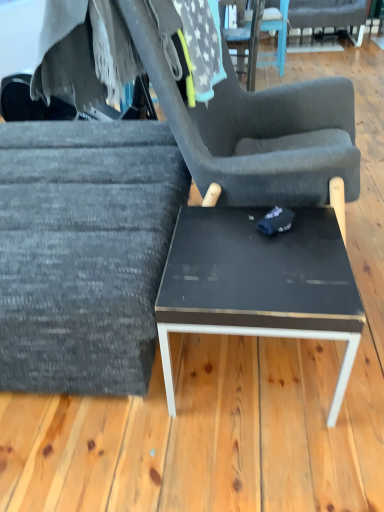
How much space does dark gray fabric chair at upper right, the third chair positioned from the bottom, occupy horizontally?

dark gray fabric chair at upper right, the third chair positioned from the bottom, is 30.17 inches wide.

What is the approximate height of black glossy table at center?

The height of black glossy table at center is 42.81 centimeters.

The height and width of the screenshot is (512, 384). I want to click on textured gray fabric chair at left, which ranks as the first chair in left-to-right order, so click(x=84, y=252).

Describe the element at coordinates (257, 131) in the screenshot. The height and width of the screenshot is (512, 384). I see `textured gray fabric chair at center, marked as the 2th chair in a left-to-right arrangement` at that location.

Locate an element on the screen. Image resolution: width=384 pixels, height=512 pixels. fuzzy gray blanket at upper left is located at coordinates (84, 53).

Which is more to the left, textured gray fabric chair at center, positioned as the 2th chair in back-to-front order, or dark gray fabric chair at upper right, placed as the 3th chair when sorted from left to right?

Positioned to the left is textured gray fabric chair at center, positioned as the 2th chair in back-to-front order.

Is textured gray fabric chair at center, the second chair from the bottom, looking in the opposite direction of dark gray fabric chair at upper right, marked as the first chair in a right-to-left arrangement?

No, textured gray fabric chair at center, the second chair from the bottom,'s orientation is not away from dark gray fabric chair at upper right, marked as the first chair in a right-to-left arrangement.

Identify the location of chair that is the 2nd one above the dark gray fabric chair at upper right, marked as the first chair in a right-to-left arrangement (from a real-world perspective). Image resolution: width=384 pixels, height=512 pixels. (257, 131).

Is fuzzy gray blanket at upper left facing away from black glossy table at center?

fuzzy gray blanket at upper left does not have its back to black glossy table at center.

Is fuzzy gray blanket at upper left wider or thinner than black glossy table at center?

Clearly, fuzzy gray blanket at upper left has more width compared to black glossy table at center.

Are fuzzy gray blanket at upper left and black glossy table at center beside each other?

There is a gap between fuzzy gray blanket at upper left and black glossy table at center.

Which is more to the right, fuzzy gray blanket at upper left or black glossy table at center?

Positioned to the right is black glossy table at center.

Which object is positioned more to the left, textured gray fabric chair at left, which ranks as the first chair in left-to-right order, or black glossy table at center?

textured gray fabric chair at left, which ranks as the first chair in left-to-right order, is more to the left.

In the scene shown: Is textured gray fabric chair at left, which ranks as the first chair in left-to-right order, not near black glossy table at center?

textured gray fabric chair at left, which ranks as the first chair in left-to-right order, is actually quite close to black glossy table at center.

From the image's perspective, who appears lower, textured gray fabric chair at left, the first chair in the front-to-back sequence, or black glossy table at center?

black glossy table at center is shown below in the image.

Is dark gray fabric chair at upper right, the third chair positioned from the bottom, positioned far away from black glossy table at center?

dark gray fabric chair at upper right, the third chair positioned from the bottom, is positioned a significant distance from black glossy table at center.

Does dark gray fabric chair at upper right, placed as the first chair when sorted from back to front, appear on the right side of black glossy table at center?

Yes, dark gray fabric chair at upper right, placed as the first chair when sorted from back to front, is to the right of black glossy table at center.

Which object is thinner, dark gray fabric chair at upper right, placed as the first chair when sorted from back to front, or black glossy table at center?

black glossy table at center.

Consider the image. Which is nearer, (346, 17) or (347, 366)?

Positioned in front is point (347, 366).

From the picture: Does black glossy table at center have a lesser height compared to textured gray fabric chair at center, acting as the 2th chair starting from the top?

Yes, black glossy table at center is shorter than textured gray fabric chair at center, acting as the 2th chair starting from the top.

Find the location of a particular element. Image resolution: width=384 pixels, height=512 pixels. coffee table behind the textured gray fabric chair at center, acting as the 2th chair starting from the top is located at coordinates (259, 283).

Choose the correct answer: Is black glossy table at center inside textured gray fabric chair at center, positioned as the 2th chair in back-to-front order, or outside it?

black glossy table at center is not enclosed by textured gray fabric chair at center, positioned as the 2th chair in back-to-front order.

Does black glossy table at center have a larger size compared to textured gray fabric chair at center, the second chair when ordered from right to left?

Actually, black glossy table at center might be smaller than textured gray fabric chair at center, the second chair when ordered from right to left.

Is dark gray fabric chair at upper right, placed as the 3th chair when sorted from left to right, positioned with its back to textured gray fabric chair at center, positioned as the 2th chair in back-to-front order?

dark gray fabric chair at upper right, placed as the 3th chair when sorted from left to right, does not have its back to textured gray fabric chair at center, positioned as the 2th chair in back-to-front order.

Considering the positions of objects dark gray fabric chair at upper right, marked as the first chair in a right-to-left arrangement, and textured gray fabric chair at center, positioned as the 2th chair in front-to-back order, in the image provided, who is in front, dark gray fabric chair at upper right, marked as the first chair in a right-to-left arrangement, or textured gray fabric chair at center, positioned as the 2th chair in front-to-back order,?

textured gray fabric chair at center, positioned as the 2th chair in front-to-back order.

Considering the relative positions of dark gray fabric chair at upper right, which is the third chair in front-to-back order, and textured gray fabric chair at center, acting as the 2th chair starting from the top, in the image provided, is dark gray fabric chair at upper right, which is the third chair in front-to-back order, to the right of textured gray fabric chair at center, acting as the 2th chair starting from the top, from the viewer's perspective?

Yes, dark gray fabric chair at upper right, which is the third chair in front-to-back order, is to the right of textured gray fabric chair at center, acting as the 2th chair starting from the top.

Does dark gray fabric chair at upper right, which is the third chair in front-to-back order, have a lesser height compared to textured gray fabric chair at center, marked as the 2th chair in a left-to-right arrangement?

Indeed, dark gray fabric chair at upper right, which is the third chair in front-to-back order, has a lesser height compared to textured gray fabric chair at center, marked as the 2th chair in a left-to-right arrangement.

From a real-world perspective, is textured gray fabric chair at left, which ranks as the first chair in left-to-right order, under textured gray fabric chair at center, the second chair from the bottom?

Yes, from a real-world perspective, textured gray fabric chair at left, which ranks as the first chair in left-to-right order, is below textured gray fabric chair at center, the second chair from the bottom.

Does textured gray fabric chair at left, which is counted as the third chair, starting from the back, have a greater height compared to textured gray fabric chair at center, positioned as the 2th chair in back-to-front order?

In fact, textured gray fabric chair at left, which is counted as the third chair, starting from the back, may be shorter than textured gray fabric chair at center, positioned as the 2th chair in back-to-front order.

Is textured gray fabric chair at left, the third chair positioned from the top, inside or outside of textured gray fabric chair at center, the second chair from the bottom?

textured gray fabric chair at left, the third chair positioned from the top, is not inside textured gray fabric chair at center, the second chair from the bottom, it's outside.

What are the coordinates of `chair above the textured gray fabric chair at center, positioned as the 2th chair in front-to-back order (from the image's perspective)` in the screenshot? It's located at (328, 17).

This screenshot has width=384, height=512. In order to click on coffee table below the fuzzy gray blanket at upper left (from the image's perspective) in this screenshot , I will do `click(259, 283)`.

Based on their spatial positions, is textured gray fabric chair at center, the second chair when ordered from right to left, or dark gray fabric chair at upper right, placed as the 3th chair when sorted from left to right, closer to fuzzy gray blanket at upper left?

textured gray fabric chair at center, the second chair when ordered from right to left.

Which object lies nearer to the anchor point textured gray fabric chair at center, the second chair from the bottom, dark gray fabric chair at upper right, placed as the 3th chair when sorted from left to right, or textured gray fabric chair at left, the third chair from the right?

Among the two, textured gray fabric chair at left, the third chair from the right, is located nearer to textured gray fabric chair at center, the second chair from the bottom.

Looking at the image, which one is located closer to textured gray fabric chair at left, which is counted as the third chair, starting from the back, dark gray fabric chair at upper right, placed as the 3th chair when sorted from left to right, or textured gray fabric chair at center, marked as the 2th chair in a left-to-right arrangement?

textured gray fabric chair at center, marked as the 2th chair in a left-to-right arrangement, is closer to textured gray fabric chair at left, which is counted as the third chair, starting from the back.

When comparing their distances from black glossy table at center, does textured gray fabric chair at left, the 1th chair when ordered from bottom to top, or fuzzy gray blanket at upper left seem closer?

textured gray fabric chair at left, the 1th chair when ordered from bottom to top, is positioned closer to the anchor black glossy table at center.

Which object lies nearer to the anchor point textured gray fabric chair at left, which is counted as the third chair, starting from the back, black glossy table at center or fuzzy gray blanket at upper left?

The object closer to textured gray fabric chair at left, which is counted as the third chair, starting from the back, is black glossy table at center.

Looking at the image, which one is located closer to black glossy table at center, textured gray fabric chair at center, the second chair when ordered from right to left, or textured gray fabric chair at left, the third chair from the right?

textured gray fabric chair at left, the third chair from the right, lies closer to black glossy table at center than the other object.

Looking at the image, which one is located further to dark gray fabric chair at upper right, which is the third chair in front-to-back order, textured gray fabric chair at left, which ranks as the first chair in left-to-right order, or fuzzy gray blanket at upper left?

The object further to dark gray fabric chair at upper right, which is the third chair in front-to-back order, is textured gray fabric chair at left, which ranks as the first chair in left-to-right order.

Considering their positions, is fuzzy gray blanket at upper left positioned closer to textured gray fabric chair at center, positioned as the 2th chair in front-to-back order, than black glossy table at center?

The object closer to textured gray fabric chair at center, positioned as the 2th chair in front-to-back order, is black glossy table at center.

Locate an element on the screen. The image size is (384, 512). coffee table positioned between textured gray fabric chair at left, the third chair from the right, and dark gray fabric chair at upper right, placed as the first chair when sorted from back to front, from near to far is located at coordinates point(259,283).

Locate an element on the screen. This screenshot has width=384, height=512. chair between textured gray fabric chair at left, which ranks as the first chair in left-to-right order, and dark gray fabric chair at upper right, the third chair positioned from the bottom, from front to back is located at coordinates (257, 131).

Locate an element on the screen. fabric between black glossy table at center and dark gray fabric chair at upper right, placed as the 3th chair when sorted from left to right, in the front-back direction is located at coordinates (84, 53).

Locate an element on the screen. This screenshot has width=384, height=512. coffee table situated between textured gray fabric chair at left, the third chair positioned from the top, and textured gray fabric chair at center, the second chair from the bottom, from left to right is located at coordinates (259, 283).